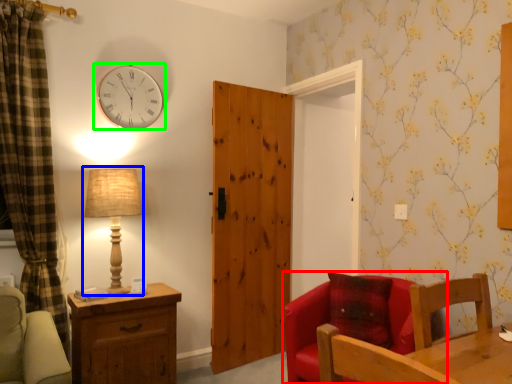
Question: Estimate the real-world distances between objects in this image. Which object is closer to chair (highlighted by a red box), table lamp (highlighted by a blue box) or wall clock (highlighted by a green box)?

Choices:
 (A) table lamp
 (B) wall clock

Answer: (A)